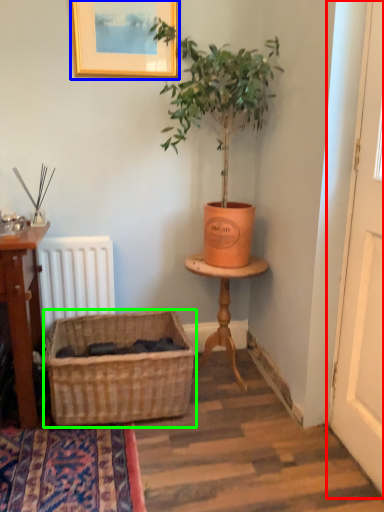
Question: Estimate the real-world distances between objects in this image. Which object is farther from screen door (highlighted by a red box), picture frame (highlighted by a blue box) or basket (highlighted by a green box)?

Choices:
 (A) picture frame
 (B) basket

Answer: (A)